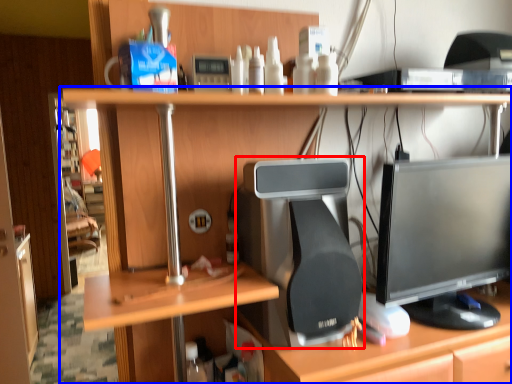
Question: Among these objects, which one is farthest to the camera, desktop computer (highlighted by a red box) or desk (highlighted by a blue box)?

Choices:
 (A) desktop computer
 (B) desk

Answer: (A)